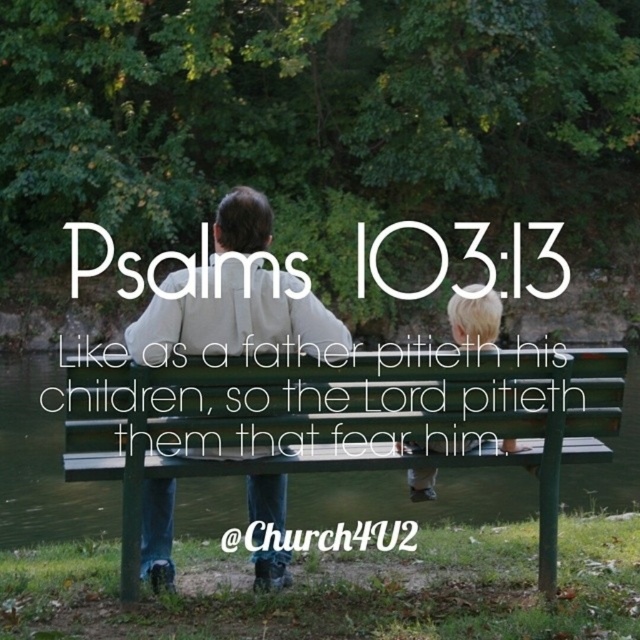
You are a photographer trying to capture a photo of the green wooden bench at center and the white matte shirt at center. If you want to ensure both are in focus, which one should you focus on first?

The green wooden bench at center is bigger than the white matte shirt at center, so you should focus on the green wooden bench at center first to ensure both are in focus.

You are a delivery robot with a package that is 30 inches wide. You need to place the package between the green wooden bench at center and the white matte shirt at center. Is there enough space to fit the package between them?

The distance between the green wooden bench at center and the white matte shirt at center is 29.23 inches. Since the package is 30 inches wide, it is slightly wider than the available space. Therefore, the package cannot fit between them.